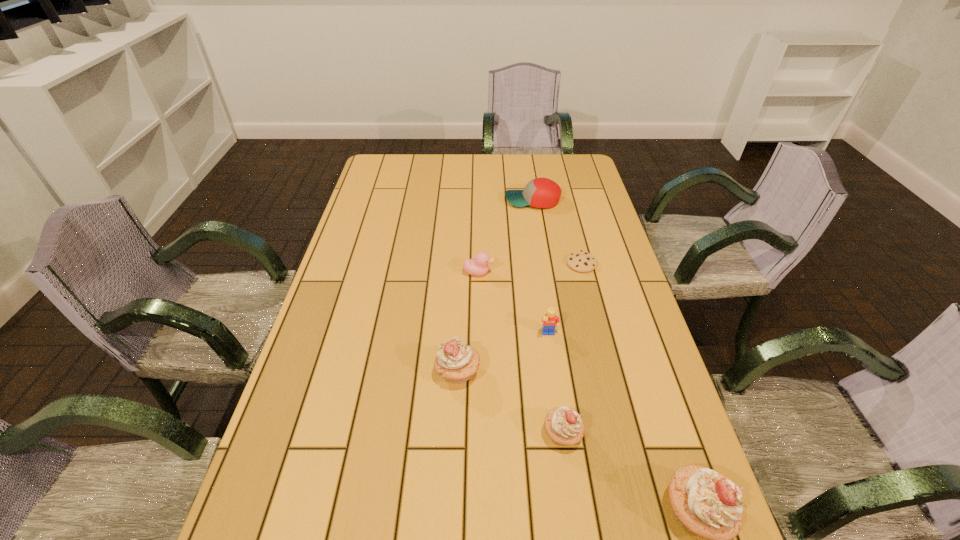
The cupcakes are evenly distributed in the image. To maintain this, where would you place another cupcake on the left? Please point to a free space. Please provide its 2D coordinates. Your answer should be formatted as a tuple, i.e. [(x, y)], where the tuple contains the x and y coordinates of a point satisfying the conditions above.

[(374, 323)]